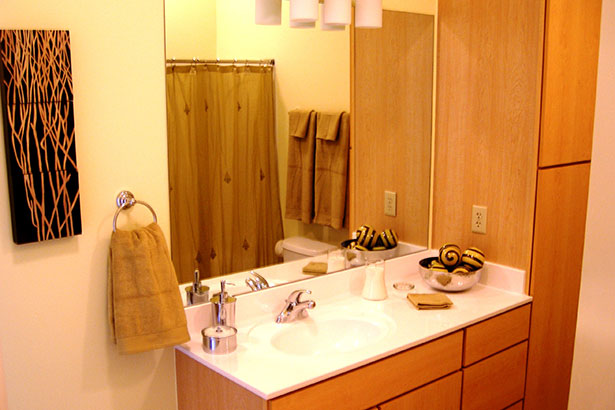
What are the coordinates of `outlet` in the screenshot? It's located at (478, 218).